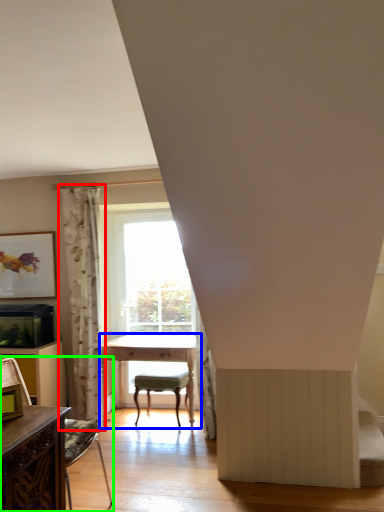
Question: Based on their relative distances, which object is nearer to curtain (highlighted by a red box)? Choose from table (highlighted by a blue box) and chair (highlighted by a green box).

Choices:
 (A) table
 (B) chair

Answer: (A)